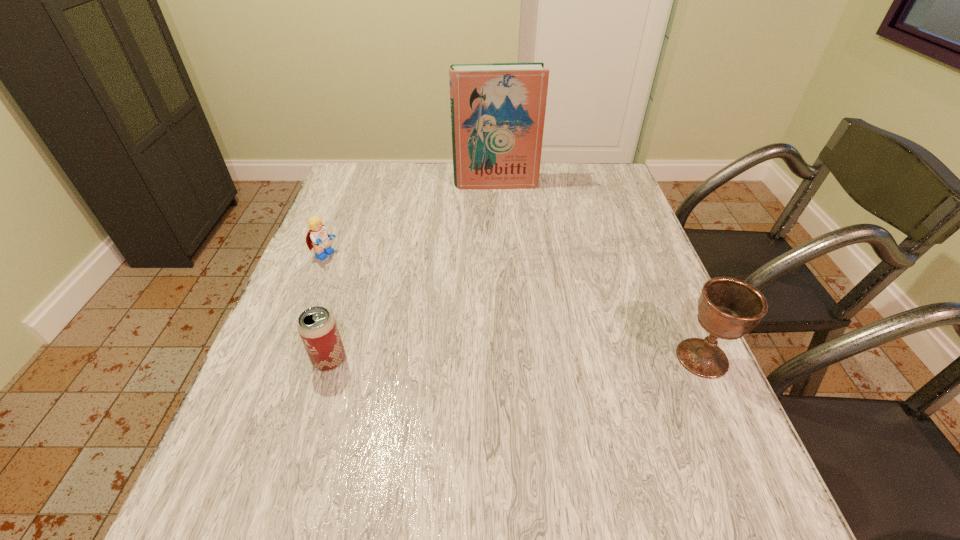
The image size is (960, 540). I want to click on vacant region at the near edge of the desktop, so click(x=643, y=450).

Find the location of a particular element. The width and height of the screenshot is (960, 540). vacant area at the left edge is located at coordinates [368, 242].

I want to click on free space at the right edge of the desktop, so click(x=673, y=330).

In the image, there is a desktop. At what (x,y) coordinates should I click in order to perform the action: click on vacant region at the far left corner. Please return your answer as a coordinate pair (x, y). The height and width of the screenshot is (540, 960). Looking at the image, I should click on (336, 191).

In the image, there is a desktop. Identify the location of vacant space at the near right corner. (688, 415).

You are a GUI agent. You are given a task and a screenshot of the screen. Output one action in this format:
    pyautogui.click(x=<x>, y=<y>)
    Task: Click on the vacant area between the leftmost object and the second object from left to right
    This screenshot has width=960, height=540.
    Given the screenshot: What is the action you would take?
    pyautogui.click(x=327, y=308)

Where is `free space between the third object from left to right and the rightmost object`? Image resolution: width=960 pixels, height=540 pixels. free space between the third object from left to right and the rightmost object is located at coordinates (599, 271).

Where is `free space between the farthest object and the Lego`? This screenshot has width=960, height=540. free space between the farthest object and the Lego is located at coordinates (410, 220).

Identify the location of empty space between the third object from left to right and the leftmost object. (410, 220).

Identify the location of vacant point located between the third object from right to left and the third shortest object. (516, 359).